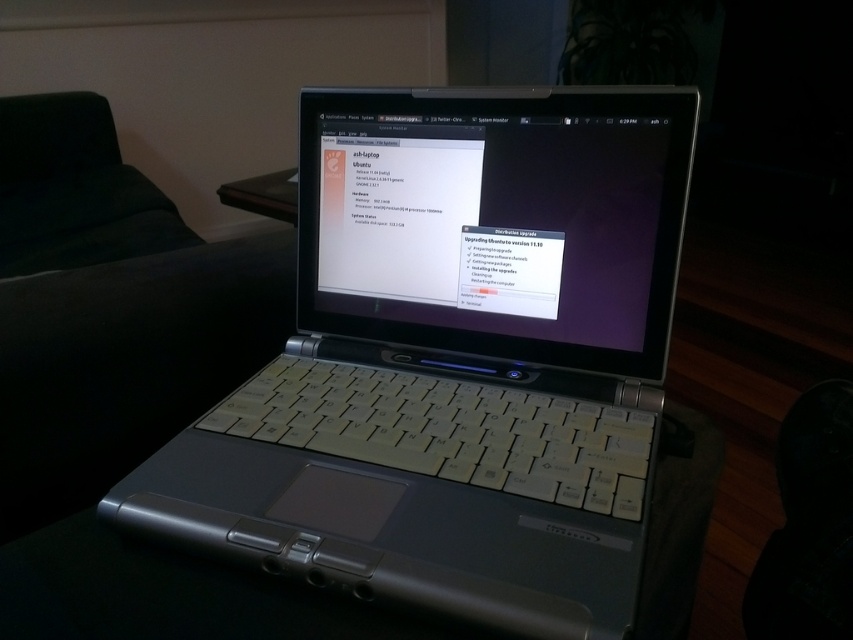
Question: Is silver metallic laptop at center above black plastic table at center?

Choices:
 (A) no
 (B) yes

Answer: (B)

Question: Is dark green fabric couch at left below dark green fabric at left?

Choices:
 (A) no
 (B) yes

Answer: (B)

Question: Which point is farther to the camera?

Choices:
 (A) black plastic table at center
 (B) dark green fabric couch at left
 (C) dark green fabric at left
 (D) silver metallic laptop at center

Answer: (C)

Question: Is matte plastic laptop screen at center wider than dark green fabric at left?

Choices:
 (A) yes
 (B) no

Answer: (B)

Question: Considering the real-world distances, which object is farthest from the silver metallic laptop at center?

Choices:
 (A) dark green fabric couch at left
 (B) black plastic table at center
 (C) dark green fabric at left

Answer: (C)

Question: Which of these objects is positioned closest to the silver metallic laptop at center?

Choices:
 (A) black plastic table at center
 (B) dark green fabric at left
 (C) dark green fabric couch at left
 (D) matte plastic laptop screen at center

Answer: (D)